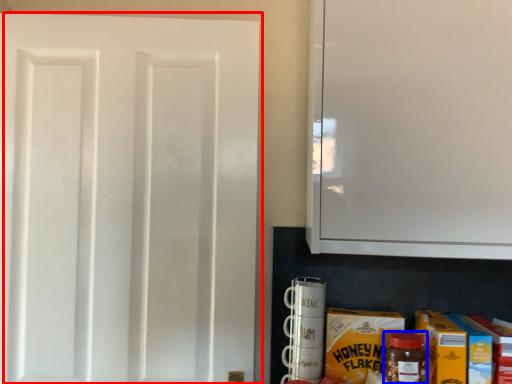
Question: Which point is closer to the camera, door (highlighted by a red box) or bottle (highlighted by a blue box)?

Choices:
 (A) door
 (B) bottle

Answer: (B)